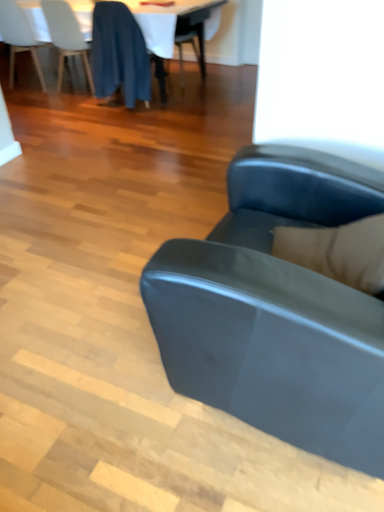
This screenshot has width=384, height=512. Find the location of `blank space to the left of matte black couch at center`. blank space to the left of matte black couch at center is located at coordinates (86, 352).